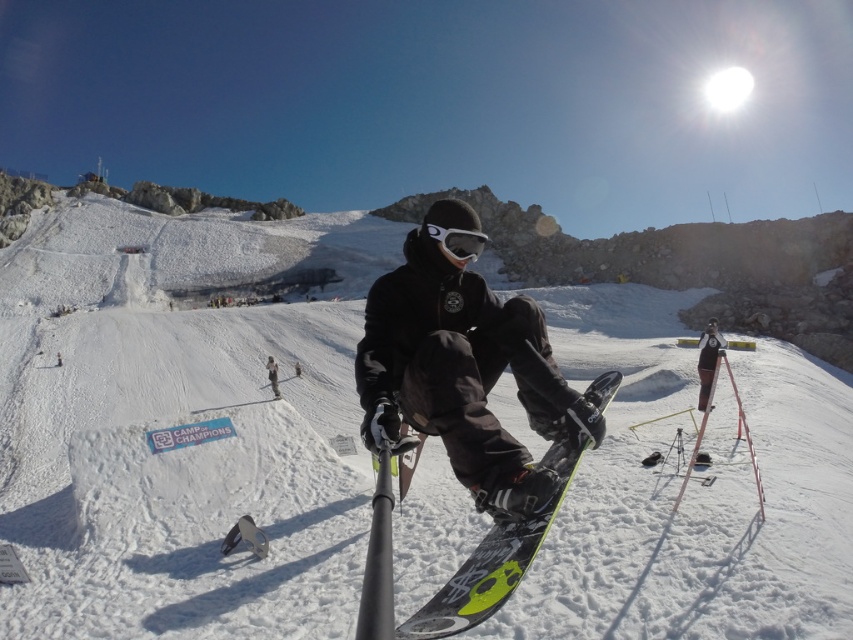
You are a photographer trying to capture a closeup of the white matte snowboard at center and the white matte goggles at center. Since you want to focus on both objects equally, which one should you zoom in on more to ensure they appear the same size in the photo?

The white matte snowboard at center is bigger than the white matte goggles at center, so you should zoom in more on the white matte goggles at center to make them appear larger and match the size of the white matte snowboard at center in the photo.

You are a photographer trying to capture a photo of the white matte snowboard at center. The camera is currently 21.50 meters away from the snowboard. To get a clear shot, you need the camera to be within 20 meters of the snowboard. Can you move closer to achieve this?

The white matte snowboard at center and camera are 21.50 meters apart from each other. Since 21.50 meters is greater than 20 meters, you cannot move closer to get within 20 meters without exceeding the current distance.